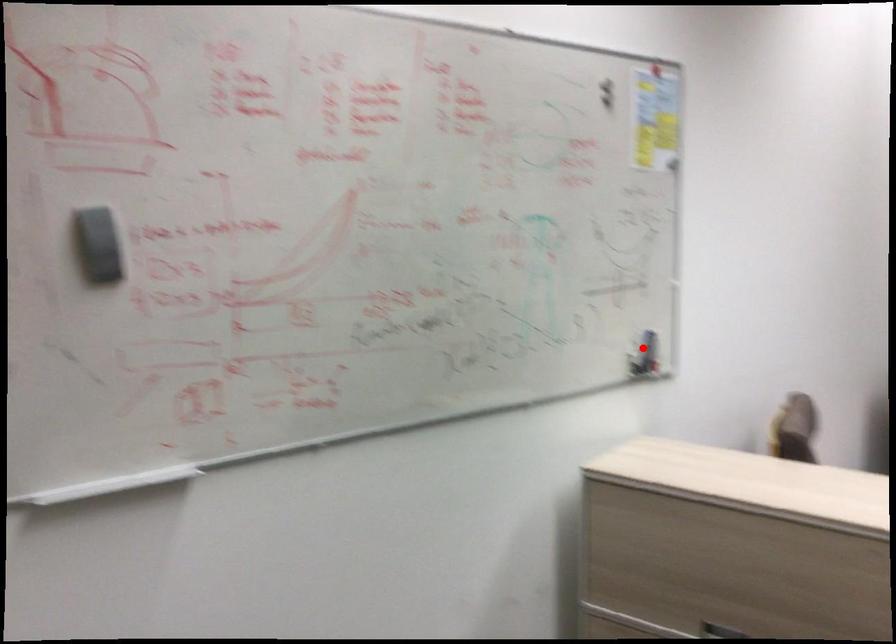
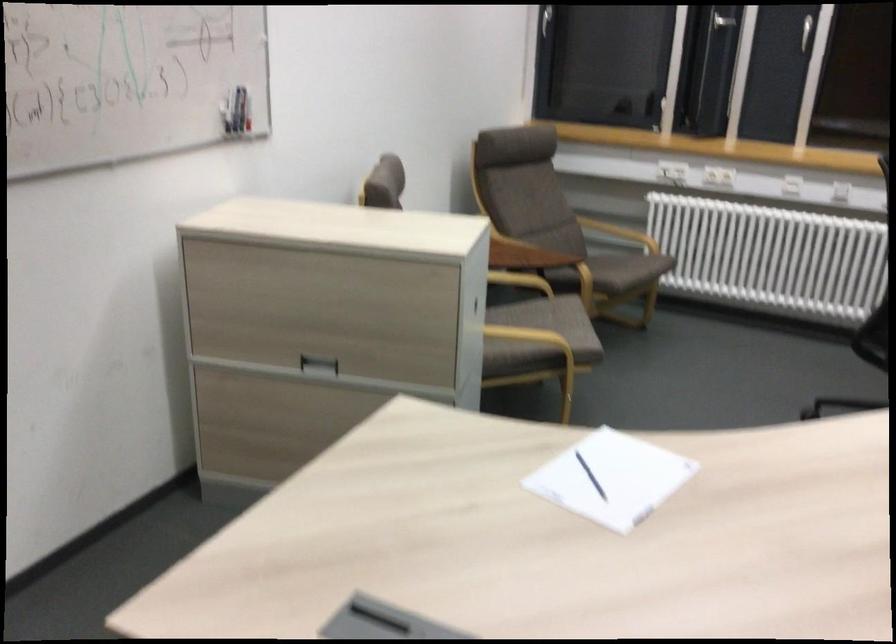
Locate, in the second image, the point that corresponds to the highlighted location in the first image.

(228, 111)